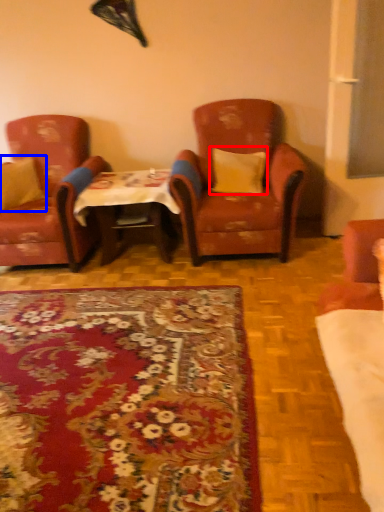
Question: Which object is closer to the camera taking this photo, pillow (highlighted by a red box) or pillow (highlighted by a blue box)?

Choices:
 (A) pillow
 (B) pillow

Answer: (A)